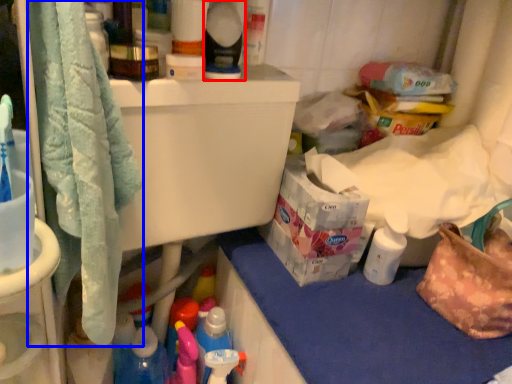
Question: Which object is further to the camera taking this photo, cleaning product (highlighted by a red box) or bath towel (highlighted by a blue box)?

Choices:
 (A) cleaning product
 (B) bath towel

Answer: (A)